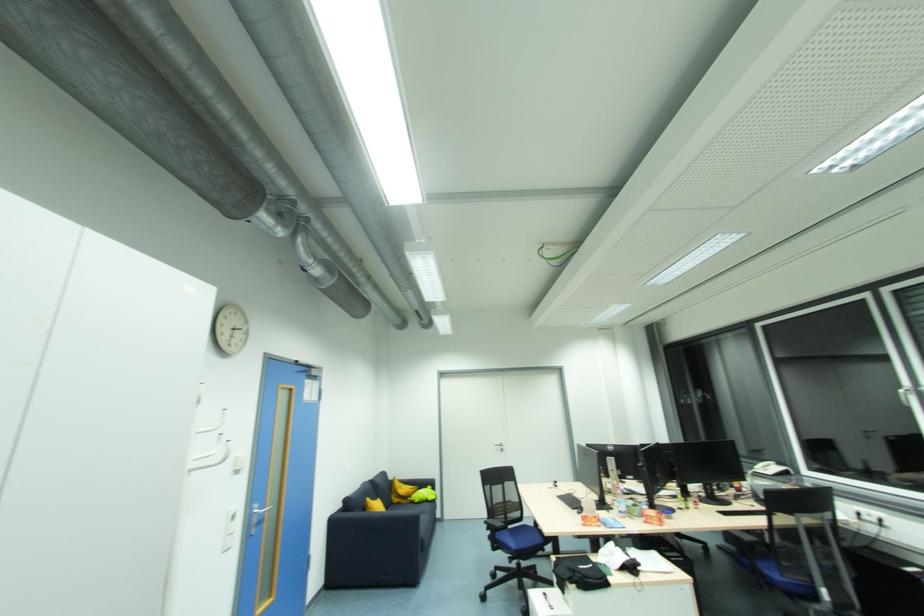
This screenshot has height=616, width=924. Describe the element at coordinates (518, 538) in the screenshot. I see `the blue chair seat` at that location.